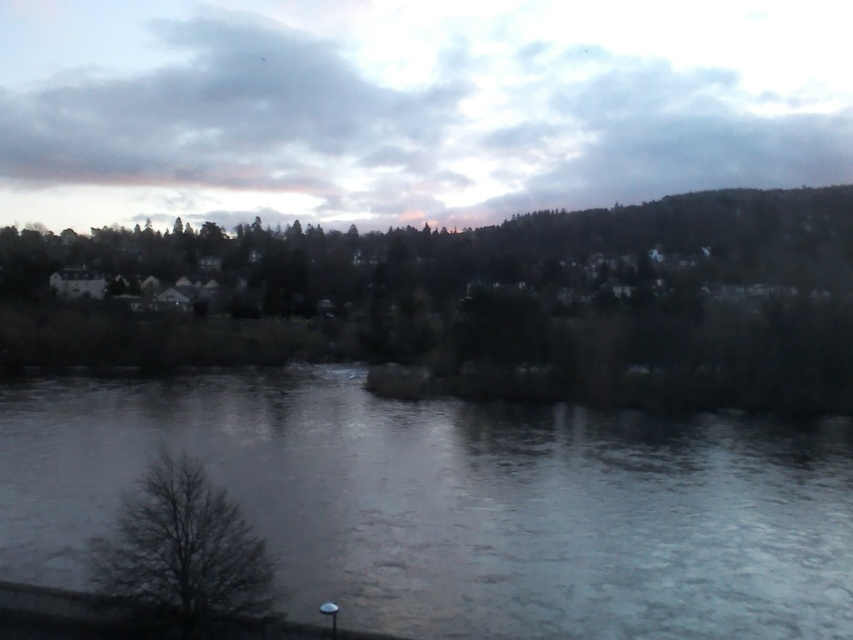
Based on the scene description, what object is located at the coordinates point (476, 300)?

The point (476, 300) marks the location of the green matte tree at center.

You are a photographer planning to capture the riverside scene. You want to ensure that the gray ice at center and the bare branches at lower left are both visible in your shot. Based on their widths, which object should you prioritize framing closer to the center of the photo to maintain balance?

The gray ice at center has a greater width than the bare branches at lower left, so prioritizing the gray ice at center near the photo center would help maintain balance due to its larger size.